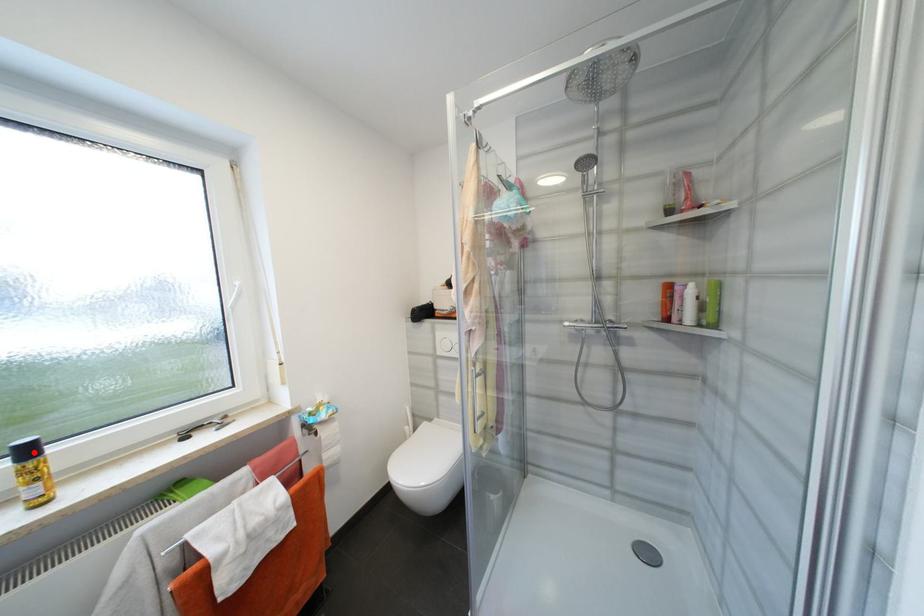
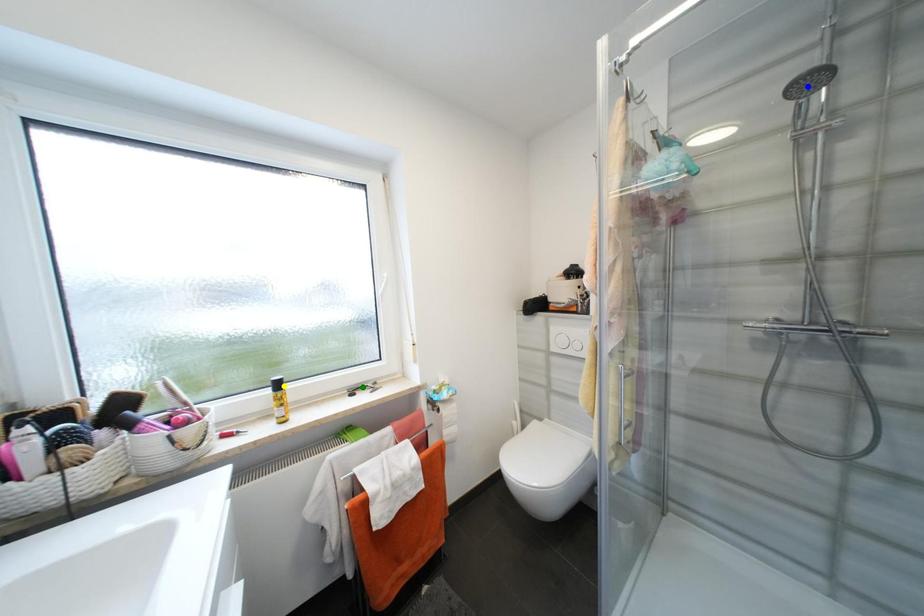
Question: I am providing you with two images of the same scene from different viewpoints. A red point is marked on the first image. You are given multiple points on the second image. Which mark in image 2 goes with the point in image 1?

Choices:
 (A) blue point
 (B) yellow point
 (C) green point

Answer: (B)